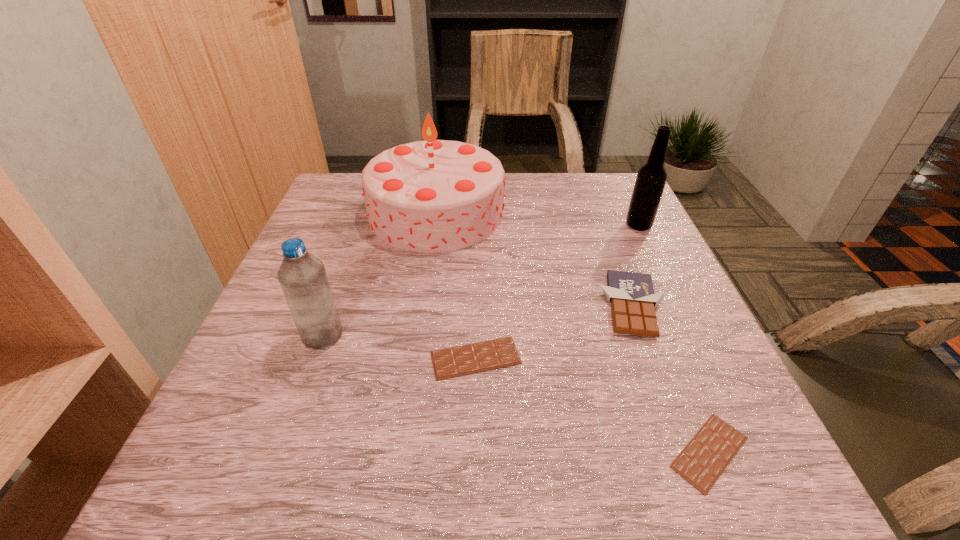
Where is `birthday cake`? This screenshot has width=960, height=540. birthday cake is located at coordinates (430, 196).

The width and height of the screenshot is (960, 540). In order to click on beer bottle in this screenshot , I will do `click(651, 178)`.

Identify the location of water bottle. This screenshot has width=960, height=540. (302, 276).

Find the location of a particular element. This screenshot has width=960, height=540. the tallest chocolate bar is located at coordinates (633, 300).

Find the location of a particular element. the leftmost chocolate bar is located at coordinates (462, 360).

Locate an element on the screen. This screenshot has width=960, height=540. the shortest chocolate bar is located at coordinates (703, 460).

Locate an element on the screen. The height and width of the screenshot is (540, 960). the nearest object is located at coordinates (703, 460).

Locate an element on the screen. vacant space situated 0.200m on the front of the birthday cake is located at coordinates (422, 317).

Where is `blank space located on the left of the beer bottle`? blank space located on the left of the beer bottle is located at coordinates (564, 225).

This screenshot has width=960, height=540. I want to click on vacant space located 0.240m on the front of the water bottle, so click(x=270, y=485).